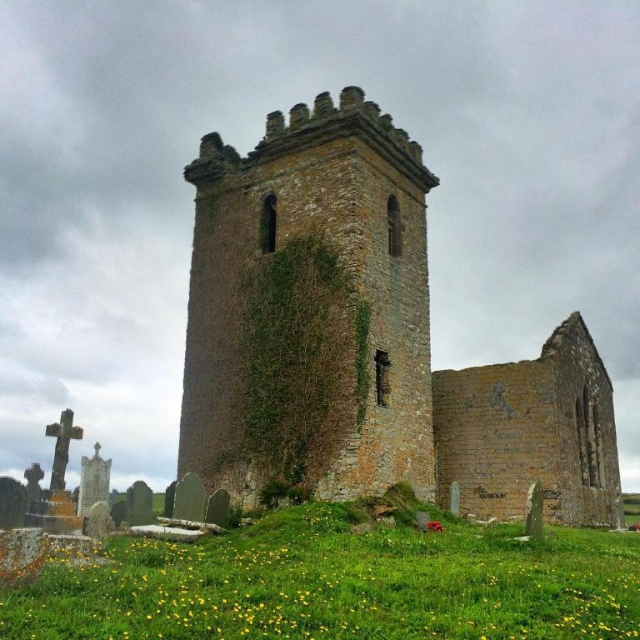
Which is above, brown stone tower at center or green mossy wall at center?

green mossy wall at center

Does brown stone tower at center have a larger size compared to green mossy wall at center?

Correct, brown stone tower at center is larger in size than green mossy wall at center.

Is point (580, 320) farther from camera compared to point (268, 422)?

Yes, it is behind point (268, 422).

Where is `brown stone tower at center`? This screenshot has height=640, width=640. brown stone tower at center is located at coordinates (364, 339).

Can you confirm if green grassy field at lower center is positioned below green mossy wall at center?

Indeed, green grassy field at lower center is positioned under green mossy wall at center.

Does point (332, 508) come farther from viewer compared to point (307, 412)?

That is False.

Who is more forward, (381, 604) or (308, 376)?

Point (381, 604)

I want to click on green grassy field at lower center, so click(x=340, y=586).

Looking at this image, does brown stone tower at center have a greater width compared to green grassy field at lower center?

Yes, brown stone tower at center is wider than green grassy field at lower center.

You are a GUI agent. You are given a task and a screenshot of the screen. Output one action in this format:
    pyautogui.click(x=<x>, y=<y>)
    Task: Click on the brown stone tower at center
    The image size is (640, 640).
    Given the screenshot: What is the action you would take?
    pyautogui.click(x=364, y=339)

Find the location of `brown stone tower at center`. brown stone tower at center is located at coordinates (364, 339).